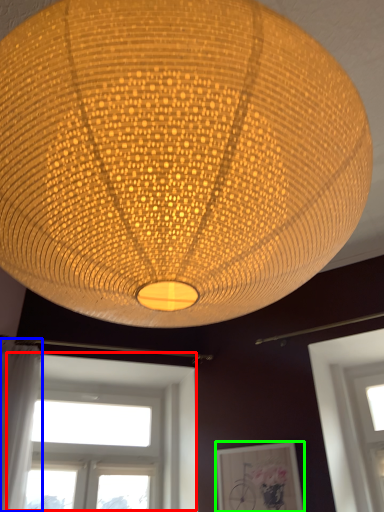
Question: Which is nearer to the window (highlighted by a red box)? curtain (highlighted by a blue box) or picture frame (highlighted by a green box).

Choices:
 (A) curtain
 (B) picture frame

Answer: (B)